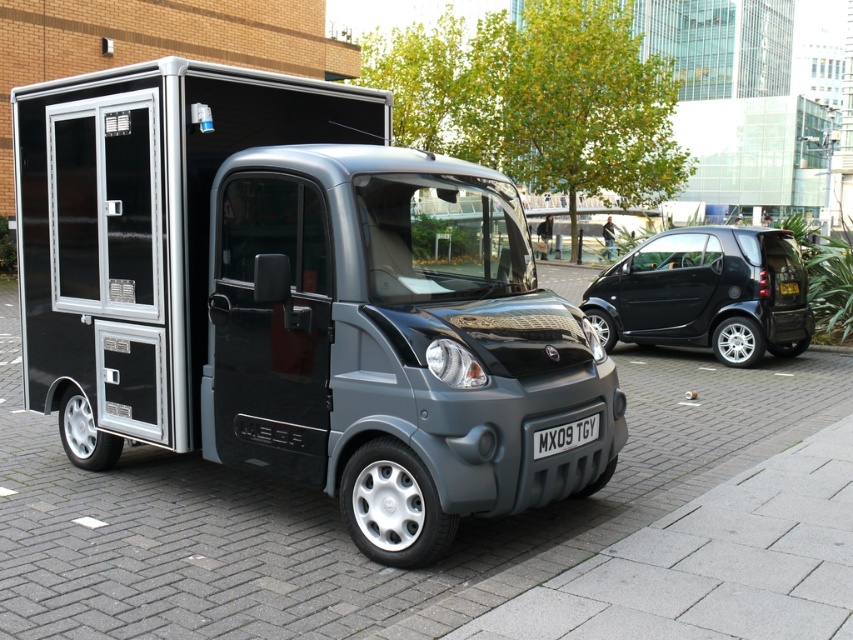
You are a delivery driver who needs to park your matte black van at center between two vehicles. There is a shiny black car at right already parked. Based on the scene, can you safely park your van to the left of the shiny black car without overlapping any vehicles?

Yes, the matte black van at center is already positioned to the left of the shiny black car at right, so there is space available to park safely without overlapping any vehicles.

You are standing at the origin point of the coordinate system where the paved area starts. You want to park your car at the location marked by the point (294, 300). Is there already a vehicle occupying that spot?

Yes, there is a matte black van at center located at point (294, 300), so the spot is already occupied.

You are a delivery driver who needs to park your matte black van at center in a tight space. There is a white plastic license plate at center in the parking area. Can you park the van without overlapping the license plate?

The matte black van at center is positioned on the left side of the white plastic license plate at center, so you can park the van without overlapping the license plate as long as you align it to the left side of the license plate.